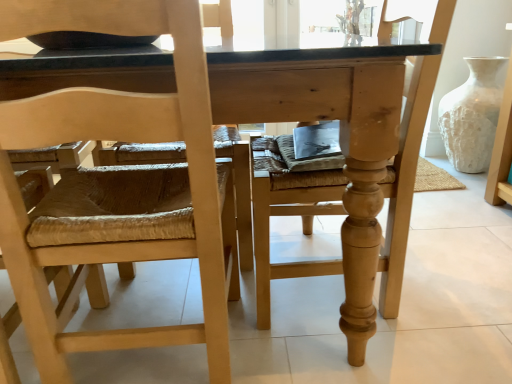
Question: Can you confirm if natural wood chair at center, the first chair when ordered from right to left, is bigger than white textured vase at right?

Choices:
 (A) yes
 (B) no

Answer: (A)

Question: From the image's perspective, is natural wood chair at center, the first chair when ordered from right to left, above white textured vase at right?

Choices:
 (A) no
 (B) yes

Answer: (A)

Question: Does natural wood chair at center, the first chair when ordered from right to left, lie behind white textured vase at right?

Choices:
 (A) no
 (B) yes

Answer: (A)

Question: Does natural wood chair at center, the 2th chair viewed from the left, contain white textured vase at right?

Choices:
 (A) yes
 (B) no

Answer: (B)

Question: Are natural wood chair at center, the first chair when ordered from right to left, and white textured vase at right beside each other?

Choices:
 (A) yes
 (B) no

Answer: (B)

Question: Is natural wood table at center to the left or to the right of natural wood chair at left, placed as the first chair when sorted from left to right, in the image?

Choices:
 (A) left
 (B) right

Answer: (B)

Question: In terms of height, does natural wood table at center look taller or shorter compared to natural wood chair at left, placed as the first chair when sorted from left to right?

Choices:
 (A) tall
 (B) short

Answer: (B)

Question: Is point (274, 51) closer or farther from the camera than point (74, 215)?

Choices:
 (A) farther
 (B) closer

Answer: (B)

Question: Considering their positions, is natural wood table at center located in front of or behind natural wood chair at left, the second chair viewed from the right?

Choices:
 (A) front
 (B) behind

Answer: (B)

Question: From their relative heights in the image, would you say natural wood chair at left, the second chair viewed from the right, is taller or shorter than natural wood table at center?

Choices:
 (A) short
 (B) tall

Answer: (B)

Question: Relative to natural wood table at center, is natural wood chair at left, the second chair viewed from the right, in front or behind?

Choices:
 (A) front
 (B) behind

Answer: (A)

Question: In the image, is natural wood chair at left, placed as the first chair when sorted from left to right, on the left side or the right side of natural wood table at center?

Choices:
 (A) right
 (B) left

Answer: (B)

Question: Do you think natural wood chair at left, the second chair viewed from the right, is within natural wood table at center, or outside of it?

Choices:
 (A) inside
 (B) outside

Answer: (B)

Question: From a real-world perspective, is natural wood chair at center, the 2th chair viewed from the left, above or below natural wood chair at left, placed as the first chair when sorted from left to right?

Choices:
 (A) below
 (B) above

Answer: (A)

Question: From the image's perspective, is natural wood chair at center, the 2th chair viewed from the left, above or below natural wood chair at left, placed as the first chair when sorted from left to right?

Choices:
 (A) above
 (B) below

Answer: (A)